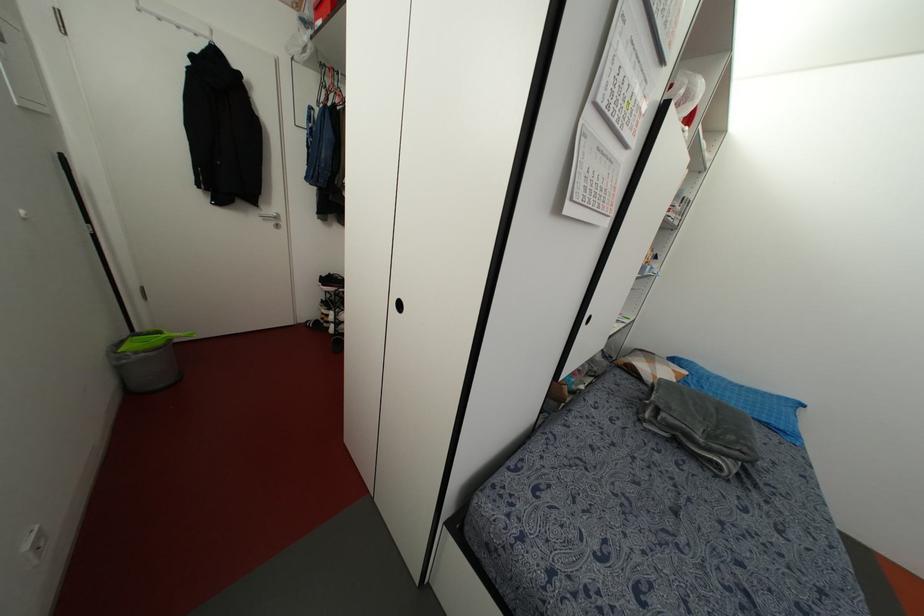
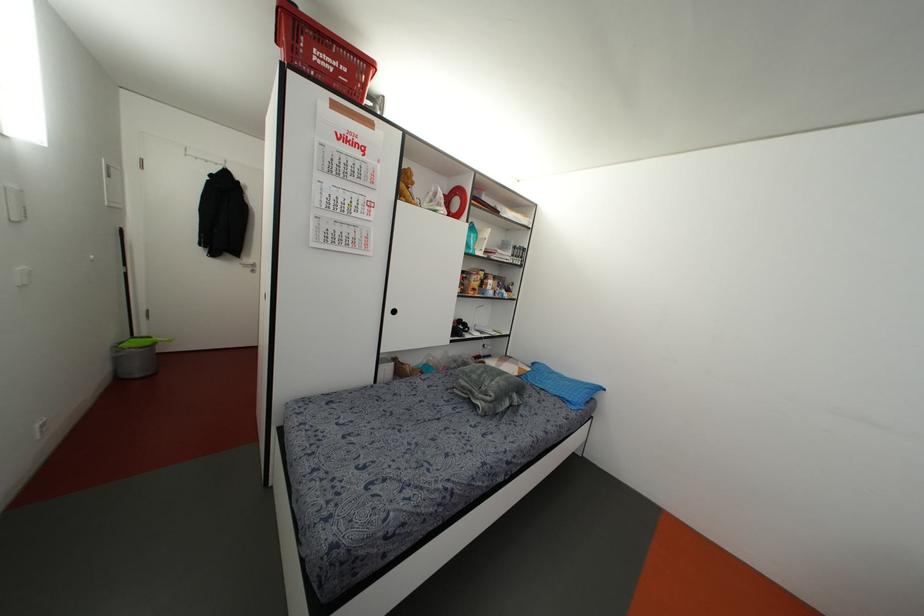
Where in the second image is the point corresponding to (276,225) from the first image?

(252, 270)